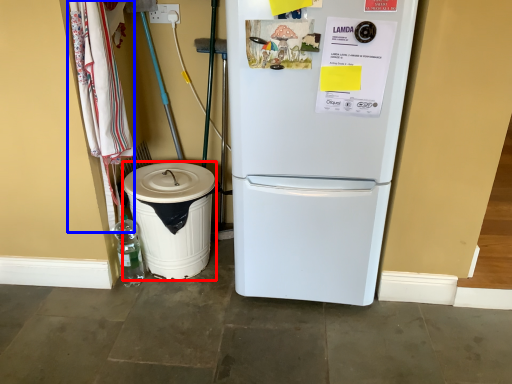
Question: Which point is further to the camera, trash bin/can (highlighted by a red box) or laundry (highlighted by a blue box)?

Choices:
 (A) trash bin/can
 (B) laundry

Answer: (A)